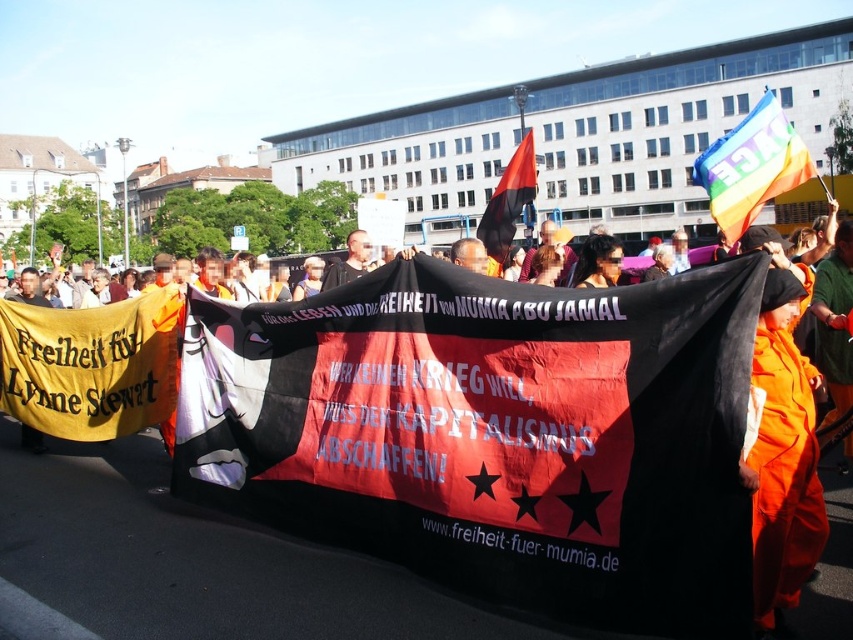
You are a photographer standing at the edge of the protest march. You want to take a photo that includes both the orange jumpsuit at center and the red fabric flag at center. Given that your camera has a maximum focus range of 5 meters, will you be able to capture both objects in focus without moving your position?

The distance between the orange jumpsuit at center and the red fabric flag at center is 5.53 meters. Since your camera can only focus within 5 meters, you won cannot capture both objects in focus without moving your position.

You are a photographer at the protest scene. You want to take a picture of the orange jumpsuit at center. Where should you aim your camera?

You should aim your camera at point (x=782, y=442) to capture the orange jumpsuit at center.

You are a photographer at the protest. You want to capture a photo that includes both the orange jumpsuit at center and the red fabric flag at center. Based on their positions, which object should you focus on first to ensure both are in frame?

The orange jumpsuit at center is located below the red fabric flag at center. To include both in the frame, focus on the red fabric flag at center first as it is higher up, then adjust the camera angle downward to include the orange jumpsuit at center below it.